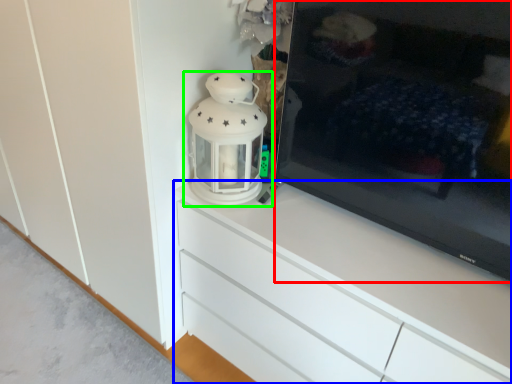
Question: Which is nearer to the television (highlighted by a red box)? chest of drawers (highlighted by a blue box) or lantern (highlighted by a green box).

Choices:
 (A) chest of drawers
 (B) lantern

Answer: (A)